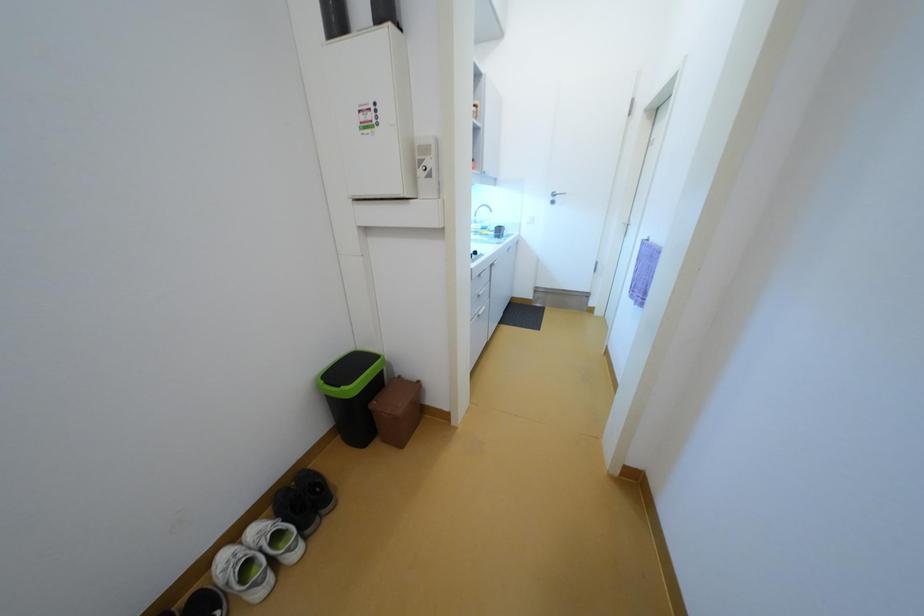
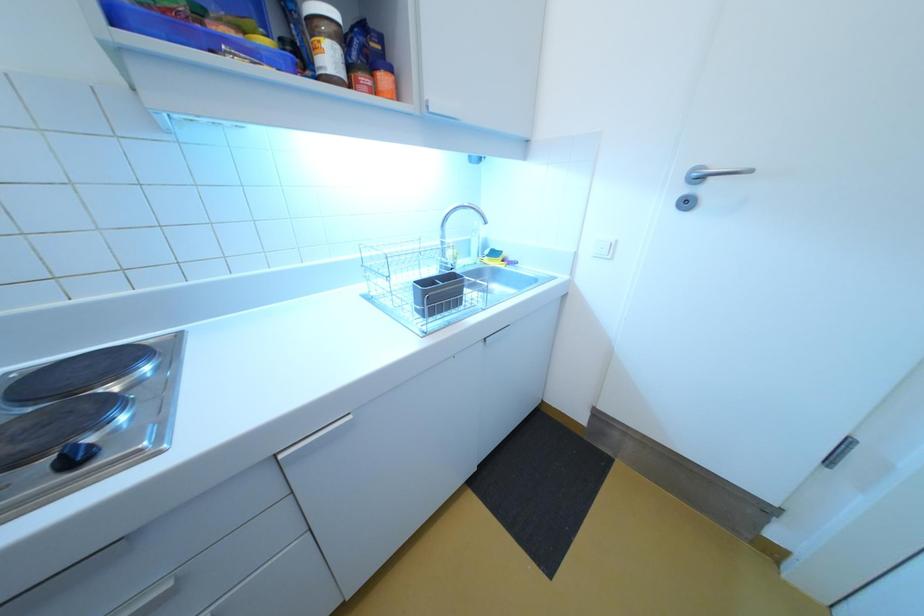
What movement of the cameraman would produce the second image?

The movement direction of the cameraman is right, forward.